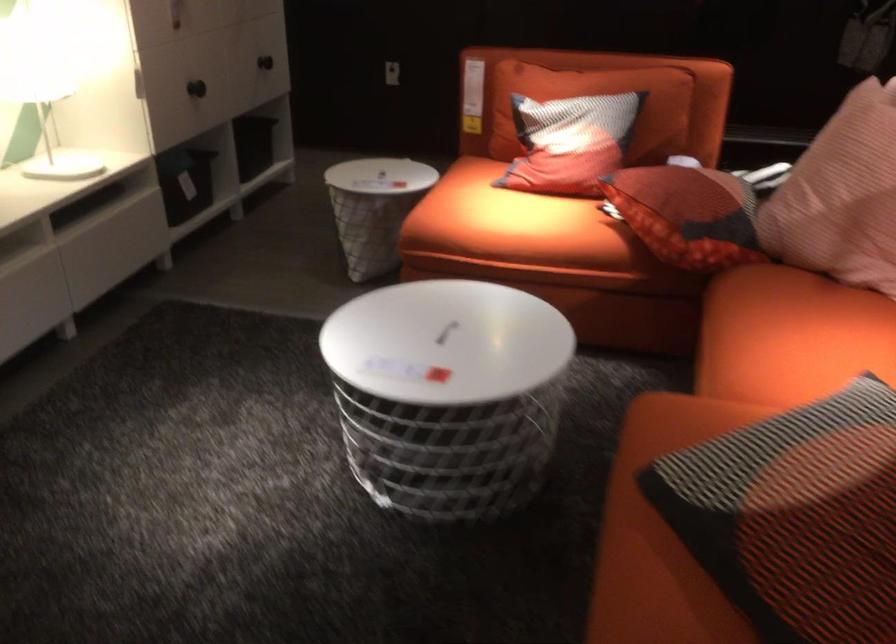
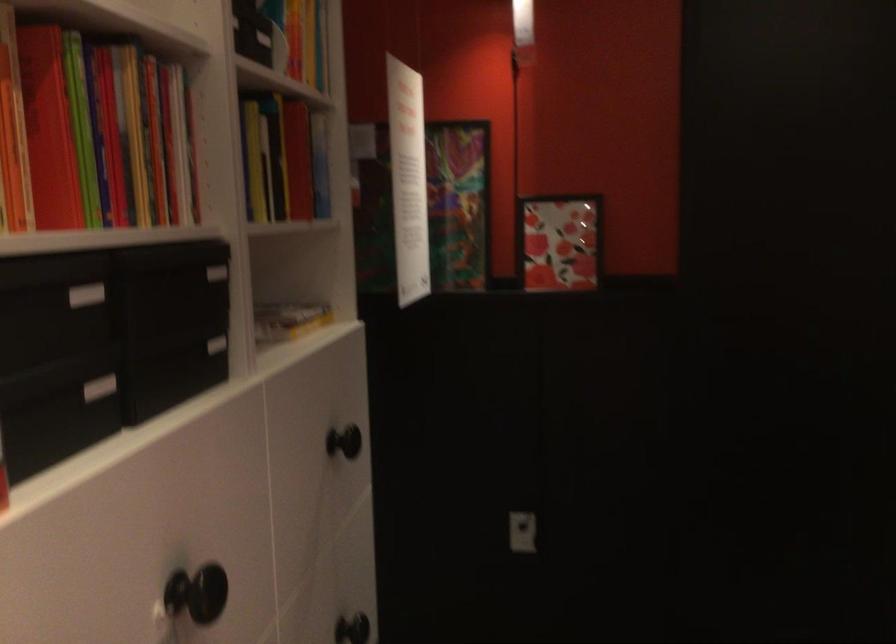
In a continuous first-person perspective shot, in which direction is the camera moving?

The movement direction of the cameraman is left, forward.